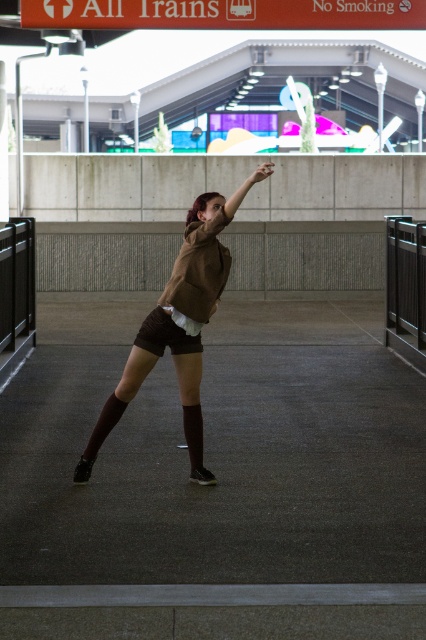
Is brown suede shorts at center bigger than matte brown arm at upper center?

Actually, brown suede shorts at center might be smaller than matte brown arm at upper center.

Is brown suede shorts at center wider than matte brown arm at upper center?

No.

Who is more forward, (161, 348) or (230, 198)?

Point (230, 198) is in front.

Image resolution: width=426 pixels, height=640 pixels. In order to click on brown suede shorts at center in this screenshot , I will do `click(164, 333)`.

Which of these two, brown suede shorts at center or matte brown sweater at center, stands taller?

brown suede shorts at center

Who is more forward, [167,323] or [186,221]?

Point [167,323]

What do you see at coordinates (164, 333) in the screenshot? Image resolution: width=426 pixels, height=640 pixels. I see `brown suede shorts at center` at bounding box center [164, 333].

This screenshot has width=426, height=640. I want to click on brown suede shorts at center, so click(164, 333).

Does brown suede hoodie at center appear on the right side of brown suede shorts at center?

Correct, you'll find brown suede hoodie at center to the right of brown suede shorts at center.

Which is behind, point (178, 339) or point (143, 342)?

Point (178, 339)

Locate an element on the screen. This screenshot has width=426, height=640. brown suede hoodie at center is located at coordinates (178, 328).